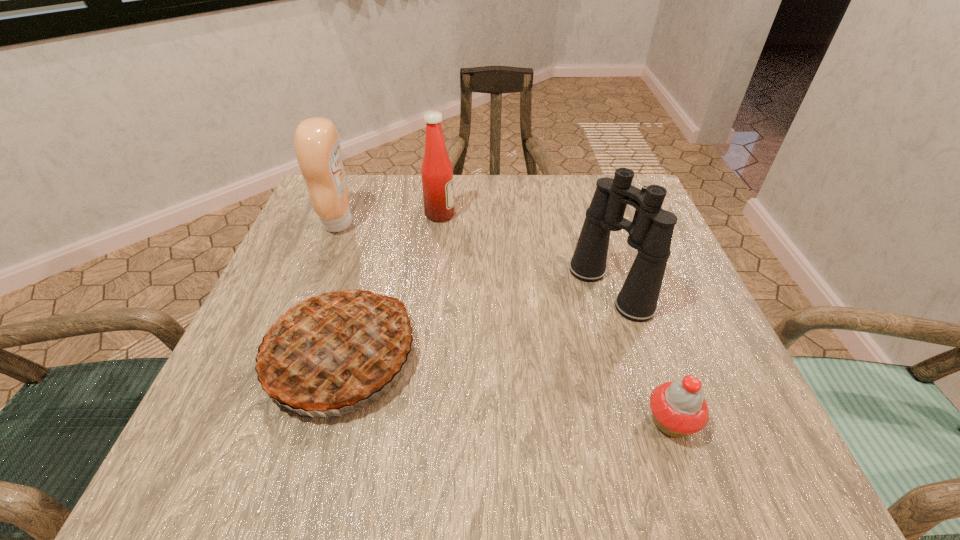
Identify the location of pie that is positioned at the near edge. This screenshot has height=540, width=960. (333, 349).

Where is `cupcake that is at the near edge`? cupcake that is at the near edge is located at coordinates (678, 407).

This screenshot has height=540, width=960. Find the location of `condiment at the left edge`. condiment at the left edge is located at coordinates (316, 141).

Identify the location of pie that is at the left edge. (333, 349).

This screenshot has width=960, height=540. What are the coordinates of `binoculars situated at the right edge` in the screenshot? It's located at (650, 232).

I want to click on cupcake situated at the right edge, so click(678, 407).

Locate an element on the screen. The image size is (960, 540). object located at the far left corner is located at coordinates pos(316,141).

The width and height of the screenshot is (960, 540). In order to click on object that is at the near left corner in this screenshot , I will do `click(333, 349)`.

Identify the location of object present at the near right corner. The width and height of the screenshot is (960, 540). (678, 407).

Locate an element on the screen. This screenshot has height=540, width=960. free space at the far edge of the desktop is located at coordinates (468, 187).